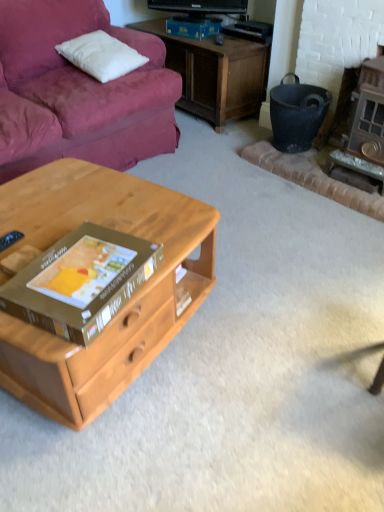
Question: Considering the relative sizes of black matte trash bin/can at right and wooden fireplace at right in the image provided, is black matte trash bin/can at right shorter than wooden fireplace at right?

Choices:
 (A) no
 (B) yes

Answer: (B)

Question: Can you confirm if black matte trash bin/can at right is thinner than wooden fireplace at right?

Choices:
 (A) yes
 (B) no

Answer: (A)

Question: Considering the relative positions of black matte trash bin/can at right and wooden fireplace at right in the image provided, is black matte trash bin/can at right behind wooden fireplace at right?

Choices:
 (A) yes
 (B) no

Answer: (A)

Question: From the image's perspective, would you say black matte trash bin/can at right is shown under wooden fireplace at right?

Choices:
 (A) no
 (B) yes

Answer: (A)

Question: From the image's perspective, is black matte trash bin/can at right located above wooden fireplace at right?

Choices:
 (A) no
 (B) yes

Answer: (B)

Question: Considering their positions, is white soft pillow at upper left located in front of or behind brown cardboard box at center?

Choices:
 (A) front
 (B) behind

Answer: (B)

Question: Is white soft pillow at upper left to the left or to the right of brown cardboard box at center in the image?

Choices:
 (A) right
 (B) left

Answer: (B)

Question: From the image's perspective, is white soft pillow at upper left positioned above or below brown cardboard box at center?

Choices:
 (A) above
 (B) below

Answer: (A)

Question: From their relative heights in the image, would you say white soft pillow at upper left is taller or shorter than brown cardboard box at center?

Choices:
 (A) short
 (B) tall

Answer: (B)

Question: Which is correct: wooden fireplace at right is inside brown cardboard box at center, or outside of it?

Choices:
 (A) inside
 (B) outside

Answer: (B)

Question: Relative to brown cardboard box at center, is wooden fireplace at right in front or behind?

Choices:
 (A) front
 (B) behind

Answer: (B)

Question: From the image's perspective, is wooden fireplace at right located above or below brown cardboard box at center?

Choices:
 (A) below
 (B) above

Answer: (B)

Question: In the image, is wooden fireplace at right on the left side or the right side of brown cardboard box at center?

Choices:
 (A) left
 (B) right

Answer: (B)

Question: Relative to black matte trash bin/can at right, is wooden fireplace at right in front or behind?

Choices:
 (A) front
 (B) behind

Answer: (A)

Question: Is wooden fireplace at right wider or thinner than black matte trash bin/can at right?

Choices:
 (A) thin
 (B) wide

Answer: (B)